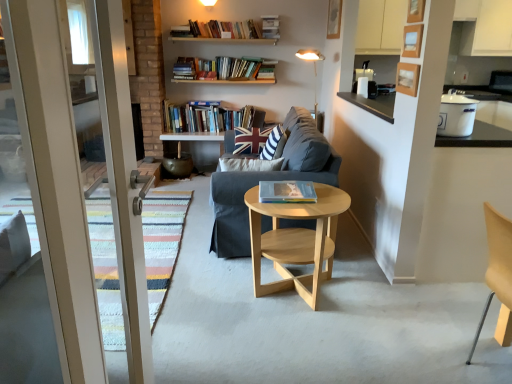
Locate an element on the screen. The image size is (512, 384). free space below light wood/woodenobject at center (from a real-world perspective) is located at coordinates (290, 302).